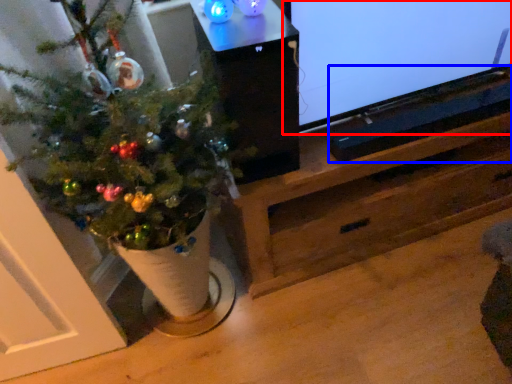
Question: Which point is closer to the camera, television (highlighted by a red box) or wide (highlighted by a blue box)?

Choices:
 (A) television
 (B) wide

Answer: (A)